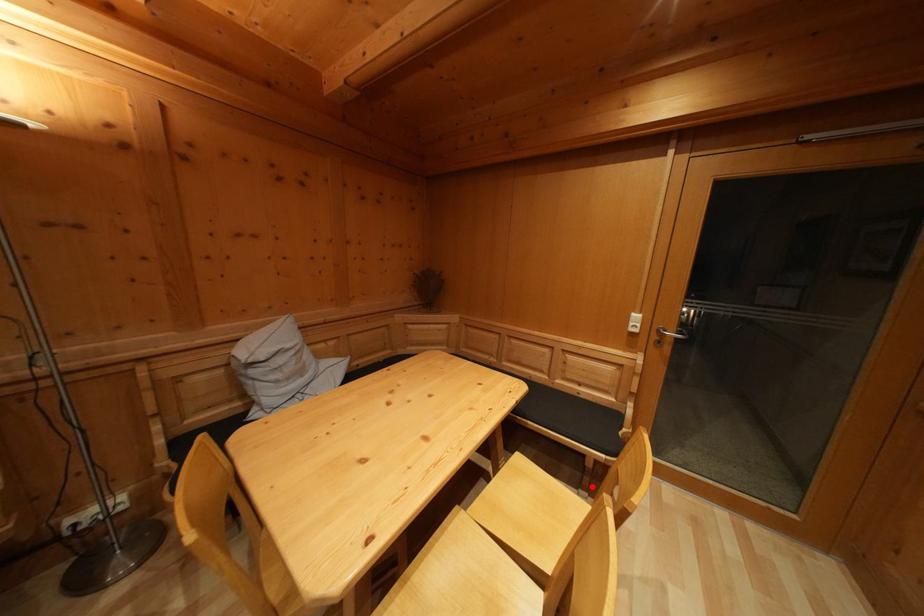
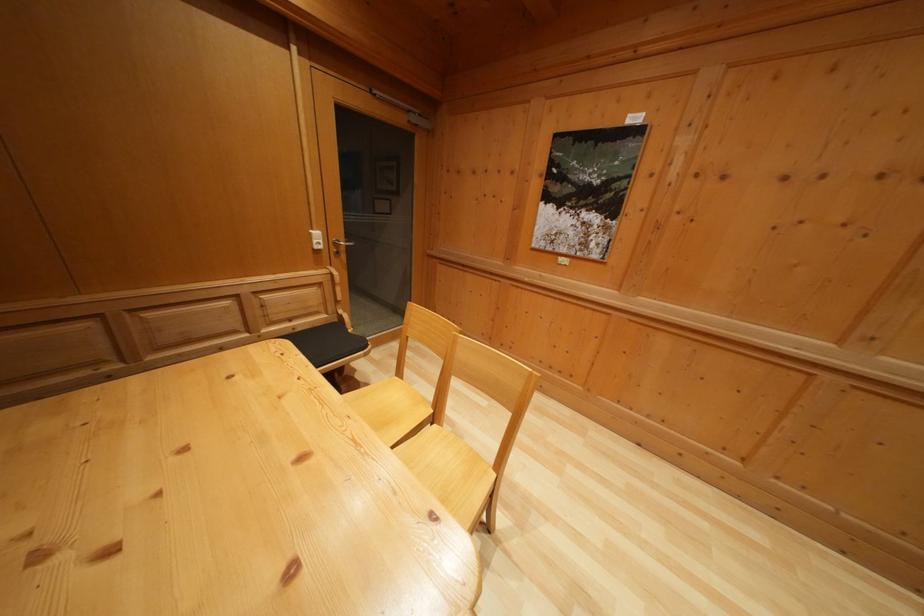
The point at the highlighted location is marked in the first image. Where is the corresponding point in the second image?

(349, 394)